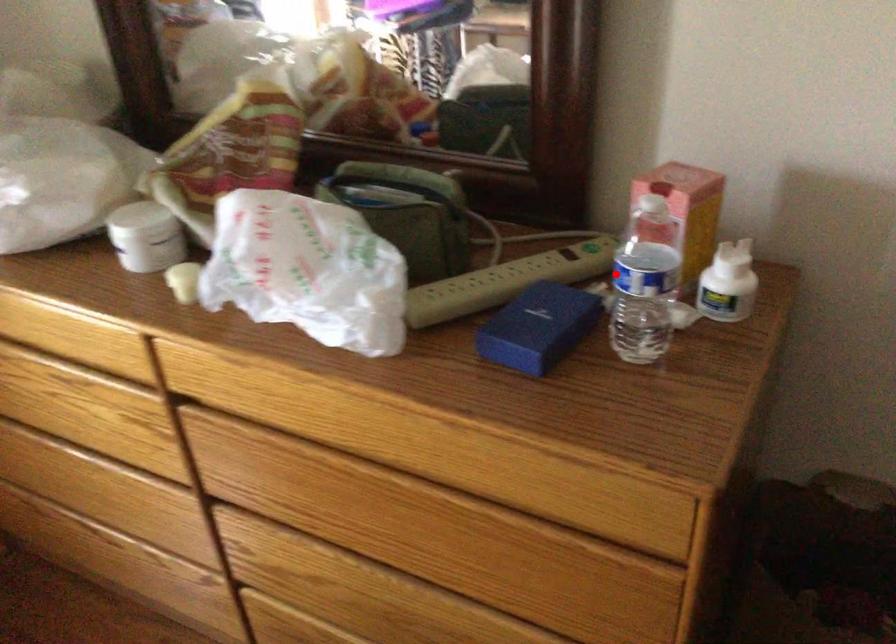
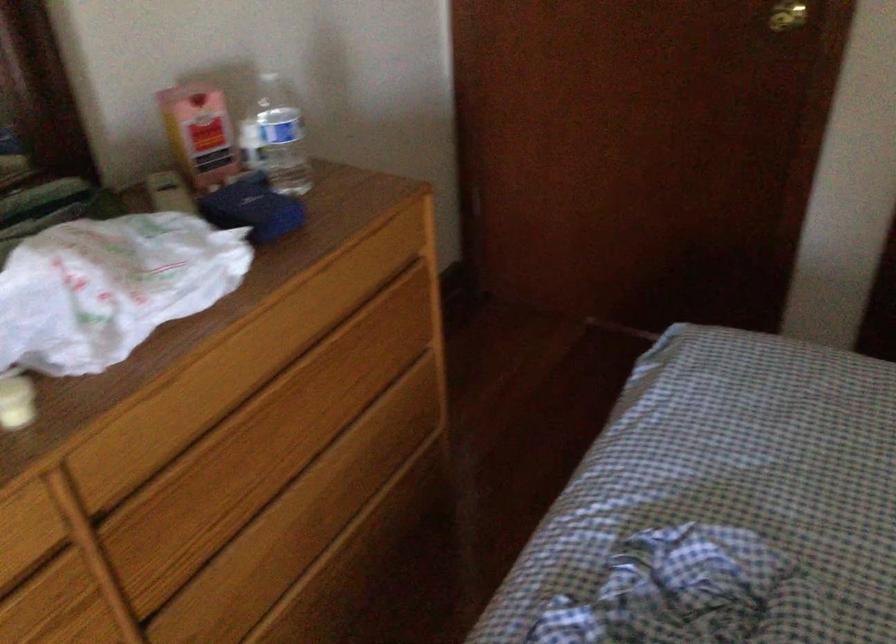
Question: I am providing you with two images of the same scene from different viewpoints. Given a red point in image1, look at the same physical point in image2. Is it:

Choices:
 (A) Closer to the viewpoint
 (B) Farther from the viewpoint

Answer: (B)